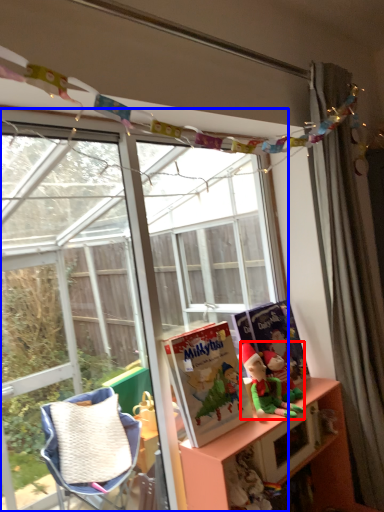
Question: Among these objects, which one is farthest to the camera, person (highlighted by a red box) or window (highlighted by a blue box)?

Choices:
 (A) person
 (B) window

Answer: (A)